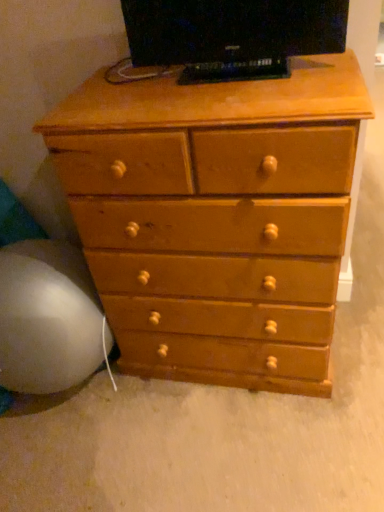
This screenshot has height=512, width=384. Identify the location of vacant area situated below matte black tv at upper center (from a real-world perspective). (264, 74).